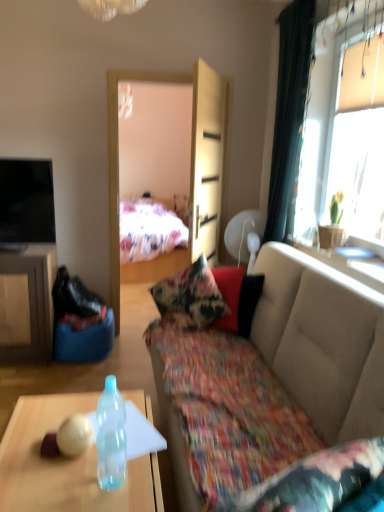
Locate an element on the screen. The width and height of the screenshot is (384, 512). transparent glass table at upper right is located at coordinates (341, 266).

Measure the distance between point [322,252] and camera.

Point [322,252] is 9.06 feet from camera.

Image resolution: width=384 pixels, height=512 pixels. Describe the element at coordinates (65, 465) in the screenshot. I see `transparent plastic bottle at lower left` at that location.

Describe the element at coordinates (289, 113) in the screenshot. I see `black fabric curtain at right` at that location.

The height and width of the screenshot is (512, 384). Describe the element at coordinates (26, 203) in the screenshot. I see `black glossy tv at upper left` at that location.

Measure the distance between point (x=272, y=301) and camera.

They are 2.36 meters apart.

The height and width of the screenshot is (512, 384). I want to click on light wood armoire at center, so click(x=207, y=161).

Does point (297, 156) appear closer or farther from the camera than point (370, 57)?

Point (297, 156).

Considering the relative sizes of black fabric curtain at right and green fabric plant at right in the image provided, is black fabric curtain at right wider than green fabric plant at right?

Indeed, black fabric curtain at right has a greater width compared to green fabric plant at right.

Choose the correct answer: Is black fabric curtain at right inside green fabric plant at right or outside it?

black fabric curtain at right is located beyond the bounds of green fabric plant at right.

From a real-world perspective, between black fabric curtain at right and green fabric plant at right, who is vertically lower?

black fabric curtain at right is physically lower.

Does green fabric plant at right touch black glossy tv at upper left?

They are not placed beside each other.

From the image's perspective, is green fabric plant at right below black glossy tv at upper left?

No, from the image's perspective, green fabric plant at right is not below black glossy tv at upper left.

Relative to black glossy tv at upper left, is green fabric plant at right in front or behind?

Visually, green fabric plant at right is located in front of black glossy tv at upper left.

How different are the orientations of green fabric plant at right and black glossy tv at upper left in degrees?

There is a 88-degree angle between the facing directions of green fabric plant at right and black glossy tv at upper left.

From the image's perspective, is light wood armoire at center positioned above or below transparent glass table at upper right?

light wood armoire at center is situated higher than transparent glass table at upper right in the image.

From the picture: Does light wood armoire at center have a lesser height compared to transparent glass table at upper right?

In fact, light wood armoire at center may be taller than transparent glass table at upper right.

Is light wood armoire at center wider than transparent glass table at upper right?

In fact, light wood armoire at center might be narrower than transparent glass table at upper right.

Where is `glass table beneath the light wood armoire at center (from a real-world perspective)`? This screenshot has height=512, width=384. glass table beneath the light wood armoire at center (from a real-world perspective) is located at coordinates (341, 266).

Is green fabric plant at right next to transparent plastic bottle at lower left?

No, green fabric plant at right is not in contact with transparent plastic bottle at lower left.

In the scene shown: Relative to transparent plastic bottle at lower left, is green fabric plant at right in front or behind?

Visually, green fabric plant at right is located behind transparent plastic bottle at lower left.

Between green fabric plant at right and transparent plastic bottle at lower left, which one has more height?

green fabric plant at right is taller.

From the image's perspective, would you say green fabric plant at right is positioned over transparent plastic bottle at lower left?

Yes, from the image's perspective, green fabric plant at right is over transparent plastic bottle at lower left.

Would you say transparent plastic bottle at lower left is to the left or to the right of green fabric plant at right in the picture?

Clearly, transparent plastic bottle at lower left is on the left of green fabric plant at right in the image.

Which of these two, transparent plastic bottle at lower left or green fabric plant at right, is thinner?

Thinner between the two is green fabric plant at right.

How different are the orientations of transparent plastic bottle at lower left and green fabric plant at right in degrees?

1.36 degrees separate the facing orientations of transparent plastic bottle at lower left and green fabric plant at right.

Between transparent plastic bottle at lower left and green fabric plant at right, which one is positioned in front?

transparent plastic bottle at lower left is closer to the camera.

From a real-world perspective, is transparent glass table at upper right positioned over floral fabric couch at center based on gravity?

Correct, in the physical world, transparent glass table at upper right is higher than floral fabric couch at center.

Is transparent glass table at upper right positioned beyond the bounds of floral fabric couch at center?

Absolutely, transparent glass table at upper right is external to floral fabric couch at center.

Consider the image. Can you confirm if transparent glass table at upper right is smaller than floral fabric couch at center?

Indeed, transparent glass table at upper right has a smaller size compared to floral fabric couch at center.

Locate an element on the screen. The height and width of the screenshot is (512, 384). glass table above the floral fabric couch at center (from a real-world perspective) is located at coordinates (341, 266).

Is point (16, 227) closer or farther from the camera than point (3, 457)?

Point (16, 227) is farther from the camera than point (3, 457).

Is black glossy tv at upper left spatially inside transparent plastic bottle at lower left, or outside of it?

The correct answer is: outside.

Is black glossy tv at upper left bigger or smaller than transparent plastic bottle at lower left?

black glossy tv at upper left is smaller than transparent plastic bottle at lower left.

Considering the relative positions of black glossy tv at upper left and transparent plastic bottle at lower left in the image provided, is black glossy tv at upper left to the left or to the right of transparent plastic bottle at lower left?

Clearly, black glossy tv at upper left is on the left of transparent plastic bottle at lower left in the image.

In the image, there is a green fabric plant at right. Find the location of `curtain below it (from a real-world perspective)`. curtain below it (from a real-world perspective) is located at coordinates (289, 113).

You are a GUI agent. You are given a task and a screenshot of the screen. Output one action in this format:
    pyautogui.click(x=<x>, y=<y>)
    Task: Click on the window above the black glossy tv at upper left (from the image's perspective)
    The width and height of the screenshot is (384, 512).
    Given the screenshot: What is the action you would take?
    pyautogui.click(x=346, y=145)

From the image, which object appears to be nearer to transparent plastic bottle at lower left, green fabric plant at right or floral fabric couch at center?

floral fabric couch at center lies closer to transparent plastic bottle at lower left than the other object.

Which object lies nearer to the anchor point transparent glass table at upper right, green fabric plant at right or transparent plastic bottle at lower left?

green fabric plant at right.

Based on the photo, from the image, which object appears to be nearer to floral fabric couch at center, transparent plastic bottle at lower left or transparent glass table at upper right?

transparent glass table at upper right is positioned closer to the anchor floral fabric couch at center.

Looking at this image, based on their spatial positions, is floral fabric couch at center or green fabric plant at right closer to transparent plastic bottle at lower left?

floral fabric couch at center lies closer to transparent plastic bottle at lower left than the other object.

From the image, which object appears to be nearer to transparent plastic bottle at lower left, transparent plastic bottle at lower left or floral fabric couch at center?

transparent plastic bottle at lower left.

Looking at the image, which one is located further to light wood armoire at center, floral fabric couch at center or transparent plastic bottle at lower left?

Among the two, transparent plastic bottle at lower left is located further to light wood armoire at center.

Based on the photo, which object lies further to the anchor point transparent plastic bottle at lower left, black fabric curtain at right or transparent plastic bottle at lower left?

black fabric curtain at right.

From the image, which object appears to be nearer to transparent plastic bottle at lower left, transparent plastic bottle at lower left or light wood armoire at center?

transparent plastic bottle at lower left lies closer to transparent plastic bottle at lower left than the other object.

At what (x,y) coordinates should I click in order to perform the action: click on window between light wood armoire at center and transparent glass table at upper right from left to right. Please return your answer as a coordinate pair (x, y). Looking at the image, I should click on [346, 145].

Locate an element on the screen. The width and height of the screenshot is (384, 512). window between floral fabric couch at center and black glossy tv at upper left from front to back is located at coordinates (346, 145).

Where is `window that lies between black fabric curtain at right and transparent plastic bottle at lower left from top to bottom`? window that lies between black fabric curtain at right and transparent plastic bottle at lower left from top to bottom is located at coordinates (346, 145).

Locate an element on the screen. The image size is (384, 512). armoire between transparent plastic bottle at lower left and black fabric curtain at right along the z-axis is located at coordinates (207, 161).